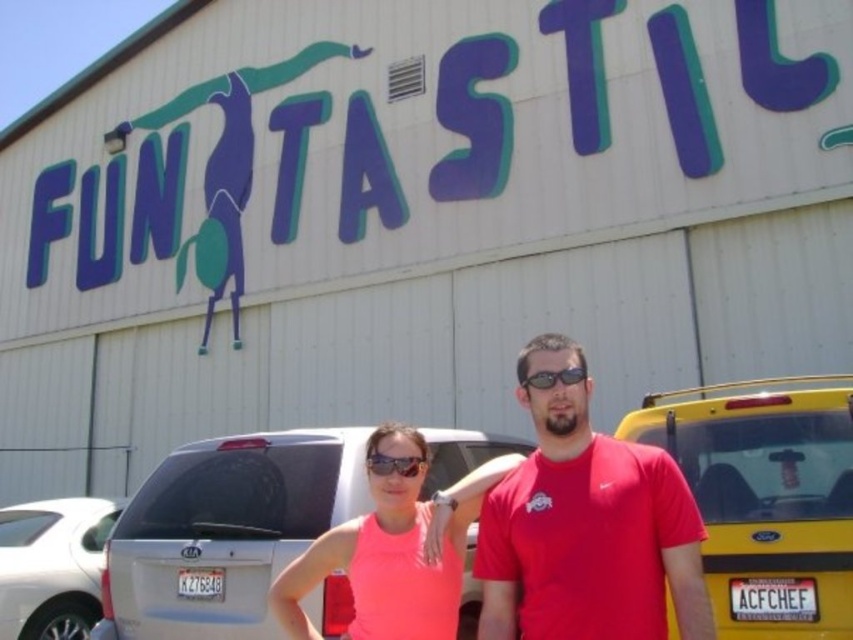
Based on the photo, does pink matte tank top at center have a greater height compared to white glossy sedan at lower left?

Correct, pink matte tank top at center is much taller as white glossy sedan at lower left.

Is point (436, 513) farther from viewer compared to point (44, 572)?

No, (436, 513) is closer to viewer.

Which is in front, point (440, 572) or point (55, 600)?

Positioned in front is point (440, 572).

I want to click on pink matte tank top at center, so click(x=393, y=550).

Is white glossy sedan at lower left above matte black goggles at center?

No, white glossy sedan at lower left is not above matte black goggles at center.

Where is `white glossy sedan at lower left`? This screenshot has height=640, width=853. white glossy sedan at lower left is located at coordinates (51, 564).

Is point (26, 556) positioned behind point (401, 461)?

Yes, it is behind point (401, 461).

I want to click on white glossy sedan at lower left, so click(51, 564).

Can you confirm if red matte t-shirt at center is thinner than pink matte tank top at center?

Yes.

Is red matte t-shirt at center positioned before pink matte tank top at center?

That is True.

Locate an element on the screen. The height and width of the screenshot is (640, 853). red matte t-shirt at center is located at coordinates (585, 525).